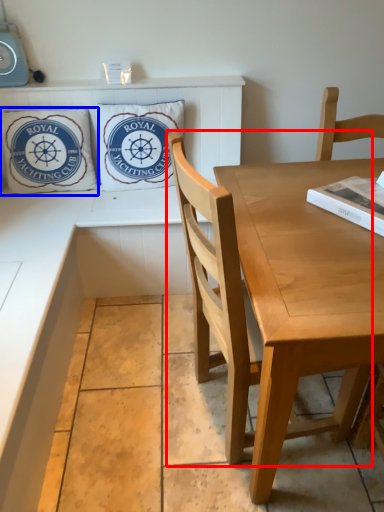
Question: Which of the following is the farthest to the observer, chair (highlighted by a red box) or pillow (highlighted by a blue box)?

Choices:
 (A) chair
 (B) pillow

Answer: (B)